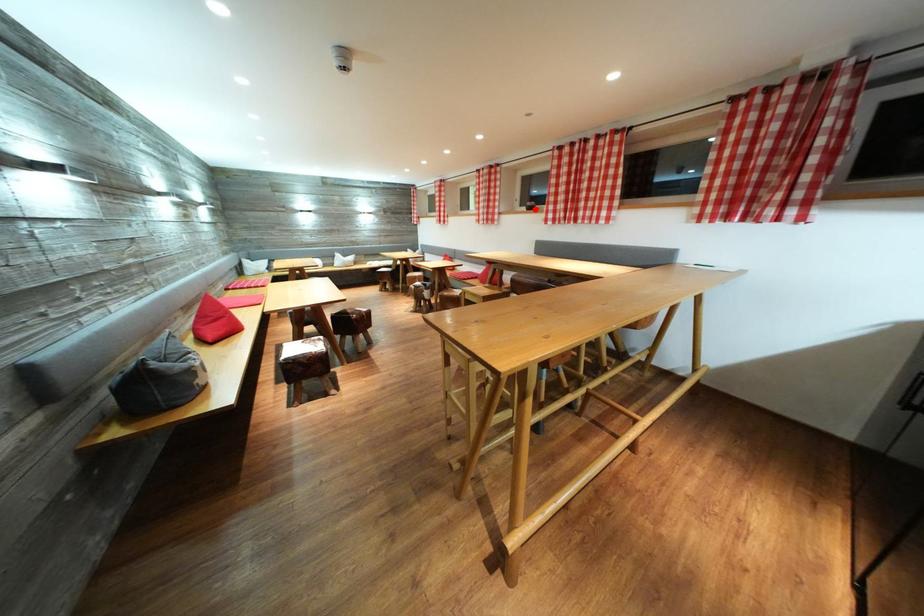
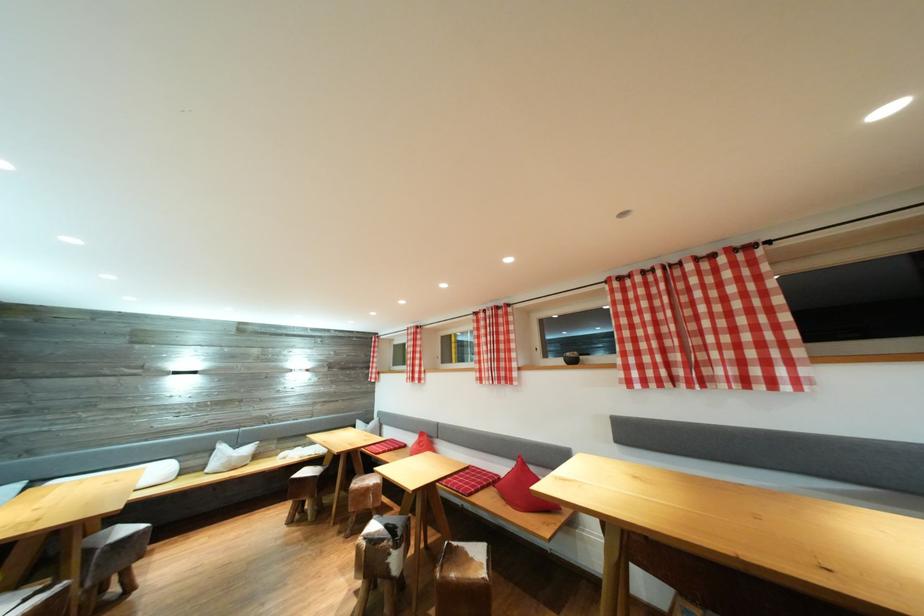
Find the pixel in the second image that matches the highlighted location in the first image.

(575, 360)